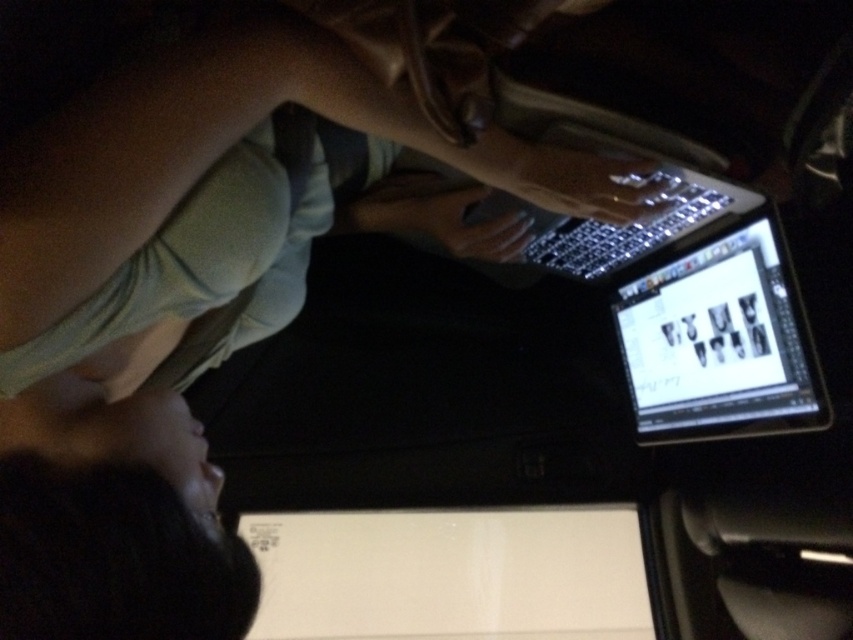
Looking at this image, how much distance is there between black matte hair at lower left and shiny black tablet at center?

black matte hair at lower left and shiny black tablet at center are 35.22 inches apart from each other.

Can you confirm if black matte hair at lower left is thinner than shiny black tablet at center?

Incorrect, black matte hair at lower left's width is not less than shiny black tablet at center's.

What do you see at coordinates (114, 557) in the screenshot? I see `black matte hair at lower left` at bounding box center [114, 557].

Locate an element on the screen. This screenshot has height=640, width=853. black matte hair at lower left is located at coordinates (114, 557).

Between black matte hair at lower left and sleek silver laptop at center, which one has more height?

With more height is sleek silver laptop at center.

Is black matte hair at lower left smaller than sleek silver laptop at center?

Yes, black matte hair at lower left is smaller than sleek silver laptop at center.

Locate an element on the screen. This screenshot has height=640, width=853. black matte hair at lower left is located at coordinates pyautogui.click(x=114, y=557).

Is shiny black tablet at center thinner than sleek silver laptop at center?

Correct, shiny black tablet at center's width is less than sleek silver laptop at center's.

Is shiny black tablet at center further to the viewer compared to sleek silver laptop at center?

Yes, shiny black tablet at center is further from the viewer.

Is point (618, 312) more distant than point (607, 268)?

Yes, it is behind point (607, 268).

Identify the location of shiny black tablet at center. (720, 340).